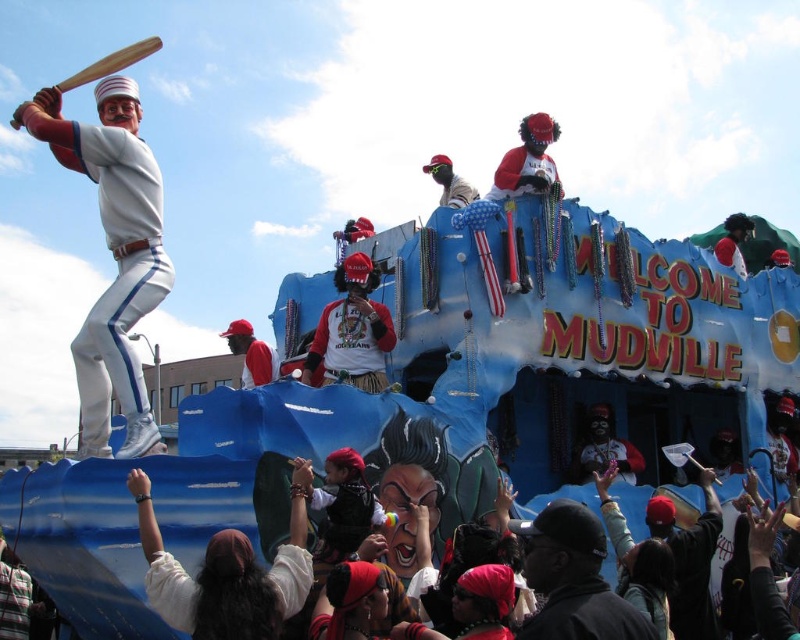
You are a participant in the parade and need to pass between the white matte baseball bat at left and the matte red cap at center. The float is moving at a constant speed of 3 feet per second. How many seconds will it take for you to completely pass through the space between them?

The distance between the white matte baseball bat at left and the matte red cap at center is 64.91 feet. At a speed of 3 feet per second, it would take approximately 21.64 seconds to pass through the space between them.

You are a photographer standing in front of the float. You want to take a photo that includes both the white matte baseball bat at left and the matte red cap at center. Which object should you adjust your camera angle to focus on first to ensure both fit in the frame?

The white matte baseball bat at left is taller than the matte red cap at center, so you should focus on the white matte baseball bat at left first to ensure its full height is captured, allowing the matte red cap at center to fit within the frame as well.